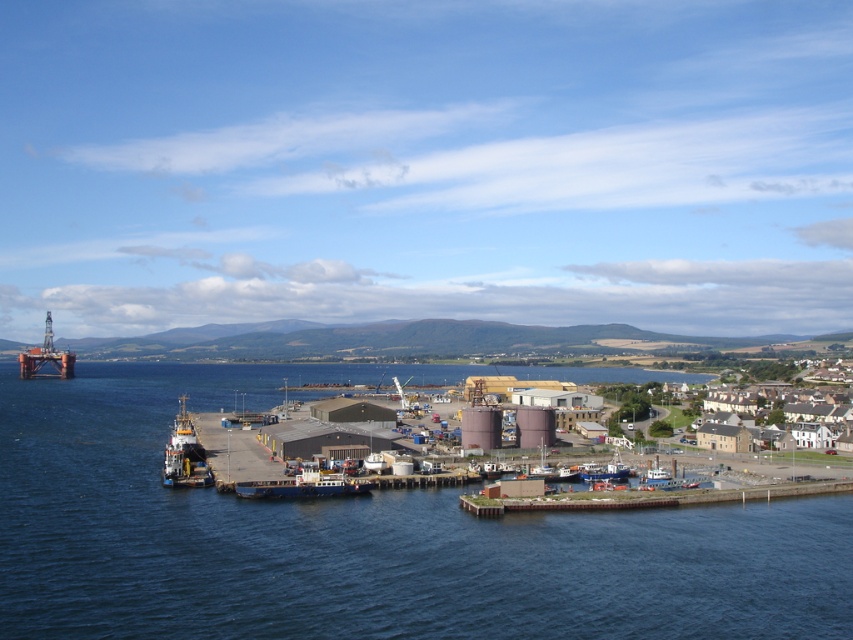
Which is below, blue matte ship at center or metallic blue boat at lower center?

Positioned lower is metallic blue boat at lower center.

Can you confirm if blue matte ship at center is positioned above metallic blue boat at lower center?

Yes, blue matte ship at center is above metallic blue boat at lower center.

Who is more forward, (302, 497) or (624, 468)?

Point (302, 497)

Where is `blue matte ship at center`? The width and height of the screenshot is (853, 640). blue matte ship at center is located at coordinates (305, 484).

Who is positioned more to the left, metallic gray boat at lower left or white plastic boat at lower right?

From the viewer's perspective, metallic gray boat at lower left appears more on the left side.

Is metallic gray boat at lower left below white plastic boat at lower right?

No.

The height and width of the screenshot is (640, 853). What do you see at coordinates (184, 452) in the screenshot?
I see `metallic gray boat at lower left` at bounding box center [184, 452].

Find the location of a particular element. This screenshot has height=640, width=853. metallic gray boat at lower left is located at coordinates (184, 452).

Between blue water at lower left and white plastic boat at lower right, which one appears on the right side from the viewer's perspective?

Positioned to the right is white plastic boat at lower right.

Is point (62, 394) closer to viewer compared to point (672, 472)?

That is False.

This screenshot has height=640, width=853. Describe the element at coordinates (361, 540) in the screenshot. I see `blue water at lower left` at that location.

This screenshot has width=853, height=640. Identify the location of blue water at lower left. (361, 540).